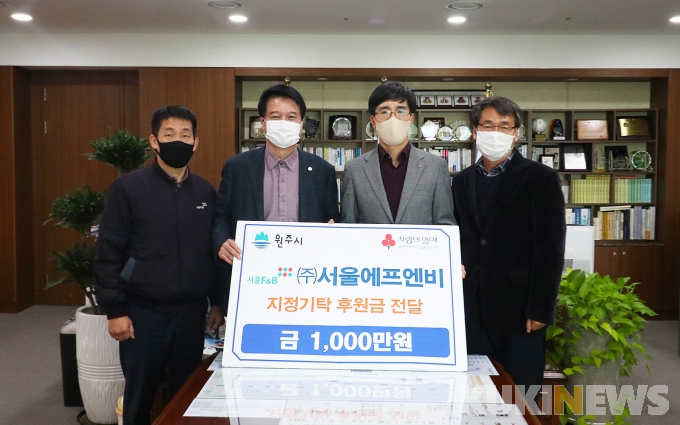
The image size is (680, 425). I want to click on door hinge, so click(x=44, y=93), click(x=43, y=123).